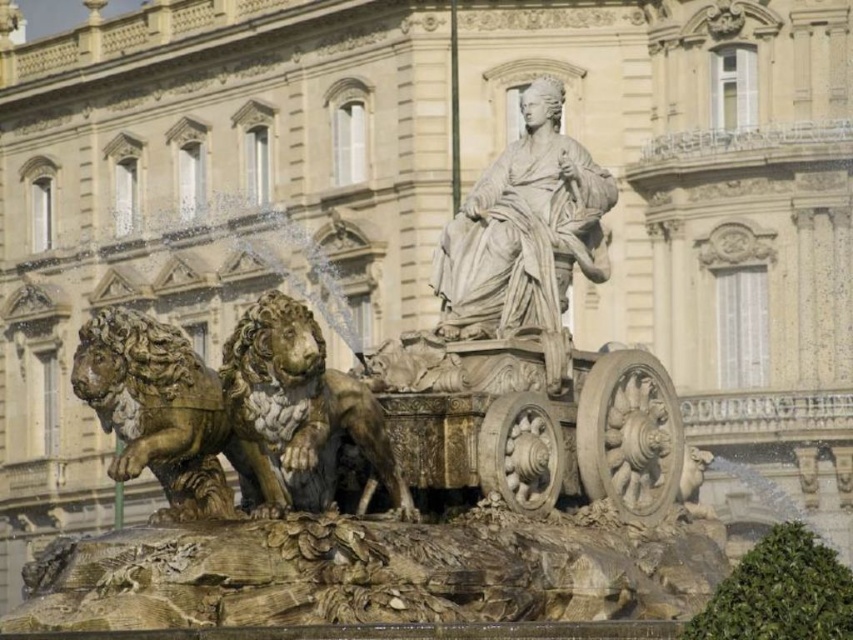
Question: Does gold polished stone lion at lower left have a smaller size compared to gold polished stone lion at center?

Choices:
 (A) no
 (B) yes

Answer: (A)

Question: Can you confirm if gold polished stone lion at lower left is positioned to the right of gold polished stone lion at center?

Choices:
 (A) yes
 (B) no

Answer: (B)

Question: Which point is farther to the camera?

Choices:
 (A) gold polished stone lion at center
 (B) gold polished stone lion at lower left

Answer: (B)

Question: Can you confirm if gold polished stone lion at lower left is smaller than gold polished stone lion at center?

Choices:
 (A) no
 (B) yes

Answer: (A)

Question: Among these points, which one is farthest from the camera?

Choices:
 (A) (230, 452)
 (B) (364, 400)

Answer: (A)